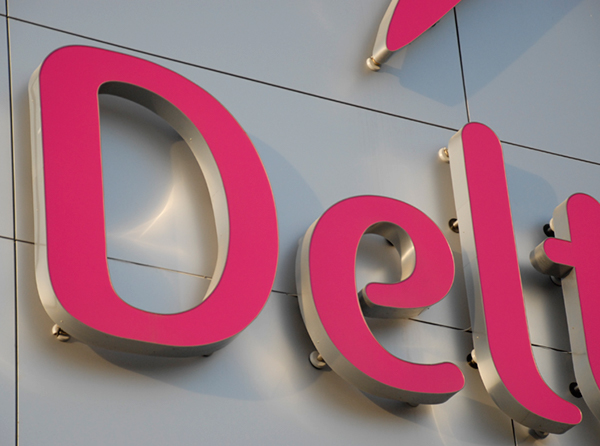
Locate an element on the screen. wall is located at coordinates click(x=221, y=43).